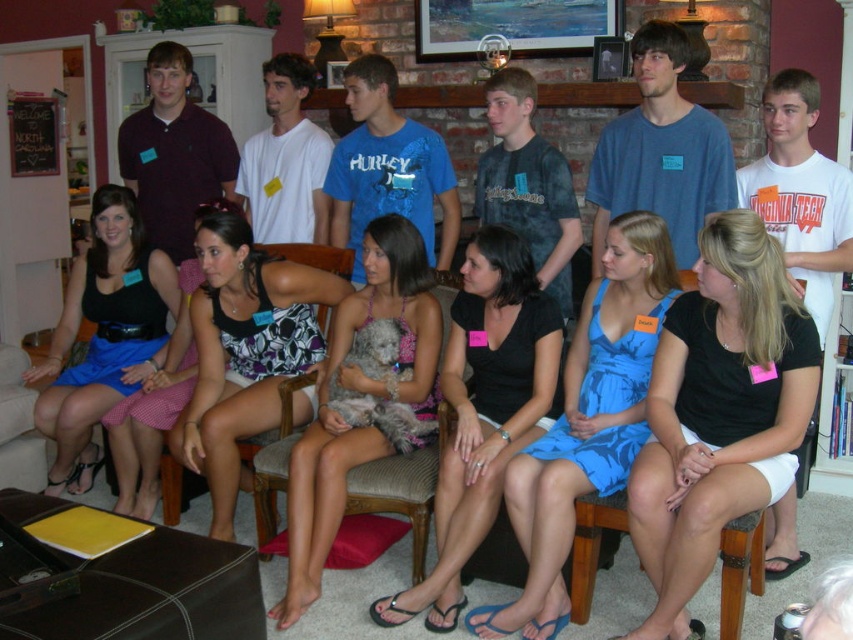
Question: Does matte black dress at center lie behind matte maroon polo shirt at upper left?

Choices:
 (A) no
 (B) yes

Answer: (A)

Question: Does black matte dress at center have a larger size compared to printed fabric tank top at center?

Choices:
 (A) yes
 (B) no

Answer: (B)

Question: Which point appears farthest from the camera in this image?

Choices:
 (A) (241, 404)
 (B) (585, 444)
 (C) (369, 273)
 (D) (743, 440)

Answer: (A)

Question: Which point is farther to the camera?

Choices:
 (A) (686, 182)
 (B) (717, 292)
 (C) (430, 376)
 (D) (235, 397)

Answer: (A)

Question: Is patterned fabric dress at center smaller than matte maroon polo shirt at upper left?

Choices:
 (A) no
 (B) yes

Answer: (A)

Question: Which of the following is the closest to the observer?

Choices:
 (A) (189, 220)
 (B) (259, 365)
 (C) (376, 284)

Answer: (C)